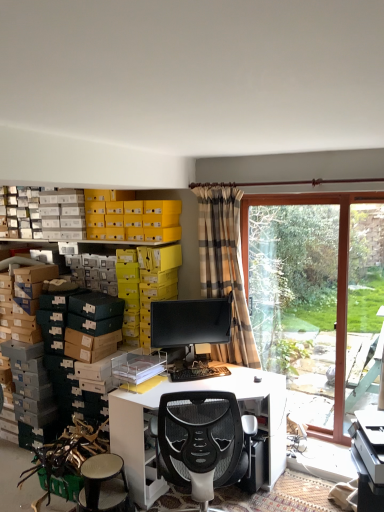
Question: From the image's perspective, is transparent glass window at right above or below matte black monitor at center?

Choices:
 (A) above
 (B) below

Answer: (A)

Question: Is point (321, 429) positioned closer to the camera than point (198, 334)?

Choices:
 (A) closer
 (B) farther

Answer: (B)

Question: Based on their relative distances, which object is farther from the plaid fabric curtain at center?

Choices:
 (A) white glossy desk at center
 (B) matte black monitor at center
 (C) black plastic keyboard at center
 (D) white textured stool at lower left
 (E) transparent glass window at right

Answer: (D)

Question: Estimate the real-world distances between objects in this image. Which object is farther from the matte black monitor at center?

Choices:
 (A) white glossy desk at center
 (B) black plastic keyboard at center
 (C) transparent glass window at right
 (D) plaid fabric curtain at center
 (E) white textured stool at lower left

Answer: (C)